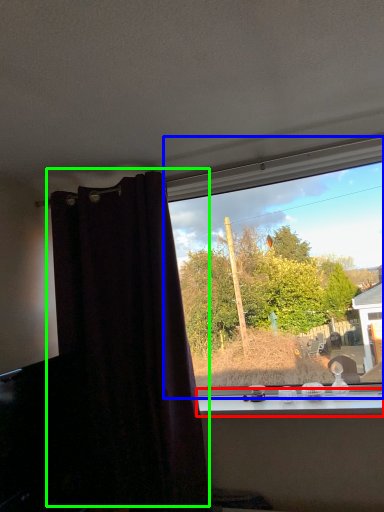
Question: Based on their relative distances, which object is farther from window sill (highlighted by a red box)? Choose from window (highlighted by a blue box) and curtain (highlighted by a green box).

Choices:
 (A) window
 (B) curtain

Answer: (A)